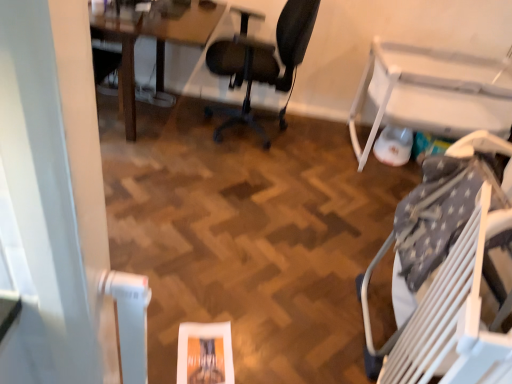
The width and height of the screenshot is (512, 384). In order to click on white plastic table at right, the 2th table when ordered from left to right in this screenshot , I will do `click(432, 92)`.

Image resolution: width=512 pixels, height=384 pixels. I want to click on black mesh office chair at center, which appears as the first chair when viewed from the left, so click(x=262, y=64).

Considering the relative sizes of black mesh office chair at center, which appears as the first chair when viewed from the left, and white plastic table at right, the 2th table when ordered from left to right, in the image provided, is black mesh office chair at center, which appears as the first chair when viewed from the left, thinner than white plastic table at right, the 2th table when ordered from left to right,?

Yes, black mesh office chair at center, which appears as the first chair when viewed from the left, is thinner than white plastic table at right, the 2th table when ordered from left to right.

From a real-world perspective, who is located lower, black mesh office chair at center, which appears as the first chair when viewed from the left, or white plastic table at right, the 2th table when ordered from left to right?

white plastic table at right, the 2th table when ordered from left to right.

Are black mesh office chair at center, the first chair from the back, and white plastic table at right, the 2th table when ordered from left to right, far apart?

They are positioned close to each other.

The width and height of the screenshot is (512, 384). I want to click on the 2nd chair counting from the right of the wooden table at upper left, placed as the first table when sorted from left to right, so click(x=445, y=267).

Between white plastic chair at lower right, the 1th chair positioned from the front, and wooden table at upper left, placed as the first table when sorted from left to right, which one has more height?

Standing taller between the two is white plastic chair at lower right, the 1th chair positioned from the front.

How much distance is there between white plastic chair at lower right, which is the second chair in back-to-front order, and wooden table at upper left, placed as the first table when sorted from left to right?

A distance of 5.82 feet exists between white plastic chair at lower right, which is the second chair in back-to-front order, and wooden table at upper left, placed as the first table when sorted from left to right.

From the image's perspective, between white plastic chair at lower right, the 1th chair positioned from the front, and wooden table at upper left, which appears as the second table when viewed from the right, which one is located above?

wooden table at upper left, which appears as the second table when viewed from the right, from the image's perspective.

From the picture: Is white plastic chair at lower right, which is the 2th chair in left-to-right order, to the right of white plastic table at right, the 2th table when ordered from left to right, from the viewer's perspective?

No.

Is white plastic chair at lower right, the second chair when ordered from top to bottom, far away from white plastic table at right, the 2th table when ordered from left to right?

Yes, white plastic chair at lower right, the second chair when ordered from top to bottom, is far from white plastic table at right, the 2th table when ordered from left to right.

Is white plastic chair at lower right, which is the 2th chair in left-to-right order, positioned with its back to white plastic table at right, which appears as the 1th table when viewed from the right?

That's not correct — white plastic chair at lower right, which is the 2th chair in left-to-right order, is not looking away from white plastic table at right, which appears as the 1th table when viewed from the right.

Considering the relative sizes of wooden table at upper left, placed as the first table when sorted from left to right, and black mesh office chair at center, the first chair from the back, in the image provided, is wooden table at upper left, placed as the first table when sorted from left to right, wider than black mesh office chair at center, the first chair from the back,?

Correct, the width of wooden table at upper left, placed as the first table when sorted from left to right, exceeds that of black mesh office chair at center, the first chair from the back.

Does wooden table at upper left, placed as the first table when sorted from left to right, turn towards black mesh office chair at center, the first chair from the back?

Yes, wooden table at upper left, placed as the first table when sorted from left to right, is facing black mesh office chair at center, the first chair from the back.

Does point (114, 26) come closer to viewer compared to point (291, 36)?

Yes, it is.

From a real-world perspective, which table is the 1st one underneath the white plastic chair at lower right, the 1th chair when ordered from bottom to top? Please provide its 2D coordinates.

[(156, 47)]

How distant is wooden table at upper left, placed as the first table when sorted from left to right, from white plastic chair at lower right, the 1th chair from the right?

They are 1.77 meters apart.

Is wooden table at upper left, which appears as the second table when viewed from the right, bigger than white plastic chair at lower right, which is the second chair in back-to-front order?

Yes, wooden table at upper left, which appears as the second table when viewed from the right, is bigger than white plastic chair at lower right, which is the second chair in back-to-front order.

Is wooden table at upper left, placed as the first table when sorted from left to right, next to white plastic chair at lower right, the 1th chair when ordered from bottom to top, and touching it?

wooden table at upper left, placed as the first table when sorted from left to right, and white plastic chair at lower right, the 1th chair when ordered from bottom to top, are not in contact.

Between black mesh office chair at center, acting as the second chair starting from the right, and wooden table at upper left, placed as the first table when sorted from left to right, which one has less height?

With less height is wooden table at upper left, placed as the first table when sorted from left to right.

Is black mesh office chair at center, the second chair when ordered from bottom to top, spatially inside wooden table at upper left, placed as the first table when sorted from left to right, or outside of it?

black mesh office chair at center, the second chair when ordered from bottom to top, lies outside wooden table at upper left, placed as the first table when sorted from left to right.

From the image's perspective, relative to wooden table at upper left, which appears as the second table when viewed from the right, is black mesh office chair at center, the second chair when ordered from front to back, above or below?

Clearly, from the image's perspective, black mesh office chair at center, the second chair when ordered from front to back, is below wooden table at upper left, which appears as the second table when viewed from the right.

Considering their positions, is black mesh office chair at center, acting as the second chair starting from the right, located in front of or behind wooden table at upper left, which appears as the second table when viewed from the right?

black mesh office chair at center, acting as the second chair starting from the right, is in front of wooden table at upper left, which appears as the second table when viewed from the right.

From a real-world perspective, which object rests below the other?

white plastic table at right, which appears as the 1th table when viewed from the right.

How much distance is there between white plastic table at right, which appears as the 1th table when viewed from the right, and wooden table at upper left, placed as the first table when sorted from left to right?

white plastic table at right, which appears as the 1th table when viewed from the right, is 1.43 meters away from wooden table at upper left, placed as the first table when sorted from left to right.

Is white plastic table at right, which appears as the 1th table when viewed from the right, oriented towards wooden table at upper left, placed as the first table when sorted from left to right?

No, white plastic table at right, which appears as the 1th table when viewed from the right, is not oriented towards wooden table at upper left, placed as the first table when sorted from left to right.

Looking at this image, does white plastic table at right, which appears as the 1th table when viewed from the right, come behind wooden table at upper left, which appears as the second table when viewed from the right?

Yes, the depth of white plastic table at right, which appears as the 1th table when viewed from the right, is greater than that of wooden table at upper left, which appears as the second table when viewed from the right.

Image resolution: width=512 pixels, height=384 pixels. In order to click on table below the black mesh office chair at center, which appears as the first chair when viewed from the left (from the image's perspective) in this screenshot , I will do `click(432, 92)`.

You are a GUI agent. You are given a task and a screenshot of the screen. Output one action in this format:
    pyautogui.click(x=<x>, y=<y>)
    Task: Click on the chair that is the 1st one above the wooden table at upper left, which appears as the second table when viewed from the right (from a real-world perspective)
    
    Given the screenshot: What is the action you would take?
    pyautogui.click(x=445, y=267)

Estimate the real-world distances between objects in this image. Which object is further from wooden table at upper left, which appears as the second table when viewed from the right, black mesh office chair at center, the first chair from the back, or white plastic chair at lower right, the 1th chair from the right?

The object further to wooden table at upper left, which appears as the second table when viewed from the right, is white plastic chair at lower right, the 1th chair from the right.

When comparing their distances from white plastic chair at lower right, the 1th chair when ordered from bottom to top, does wooden table at upper left, placed as the first table when sorted from left to right, or black mesh office chair at center, the first chair from the back, seem further?

wooden table at upper left, placed as the first table when sorted from left to right, is positioned further to the anchor white plastic chair at lower right, the 1th chair when ordered from bottom to top.

Which object lies further to the anchor point white plastic table at right, the 2th table when ordered from left to right, white plastic chair at lower right, which is the 2th chair in left-to-right order, or wooden table at upper left, which appears as the second table when viewed from the right?

wooden table at upper left, which appears as the second table when viewed from the right.

Considering their positions, is black mesh office chair at center, placed as the 1th chair when sorted from top to bottom, positioned closer to white plastic table at right, which appears as the 1th table when viewed from the right, than white plastic chair at lower right, the 1th chair positioned from the front?

black mesh office chair at center, placed as the 1th chair when sorted from top to bottom, lies closer to white plastic table at right, which appears as the 1th table when viewed from the right, than the other object.

Considering their positions, is white plastic chair at lower right, which is the second chair in back-to-front order, positioned further to white plastic table at right, the 2th table when ordered from left to right, than black mesh office chair at center, the second chair when ordered from front to back?

Among the two, white plastic chair at lower right, which is the second chair in back-to-front order, is located further to white plastic table at right, the 2th table when ordered from left to right.

Looking at the image, which one is located further to wooden table at upper left, placed as the first table when sorted from left to right, white plastic table at right, the 2th table when ordered from left to right, or white plastic chair at lower right, the 1th chair from the right?

Based on the image, white plastic chair at lower right, the 1th chair from the right, appears to be further to wooden table at upper left, placed as the first table when sorted from left to right.

From the image, which object appears to be nearer to white plastic table at right, the 2th table when ordered from left to right, wooden table at upper left, which appears as the second table when viewed from the right, or black mesh office chair at center, the second chair when ordered from front to back?

black mesh office chair at center, the second chair when ordered from front to back, is positioned closer to the anchor white plastic table at right, the 2th table when ordered from left to right.

From the image, which object appears to be nearer to black mesh office chair at center, placed as the 1th chair when sorted from top to bottom, wooden table at upper left, which appears as the second table when viewed from the right, or white plastic chair at lower right, which is the second chair in back-to-front order?

wooden table at upper left, which appears as the second table when viewed from the right, is closer to black mesh office chair at center, placed as the 1th chair when sorted from top to bottom.

Locate an element on the screen. chair positioned between white plastic chair at lower right, the 1th chair from the right, and white plastic table at right, which appears as the 1th table when viewed from the right, from near to far is located at coordinates (262, 64).

I want to click on chair between white plastic chair at lower right, which is the 2th chair in left-to-right order, and wooden table at upper left, which appears as the second table when viewed from the right, in the front-back direction, so click(x=262, y=64).